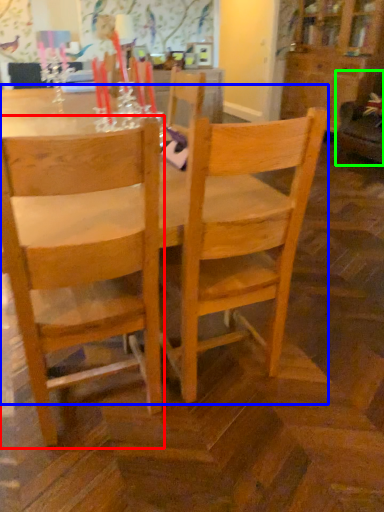
Question: Considering the real-world distances, which object is farthest from chair (highlighted by a red box)? kitchen & dining room table (highlighted by a blue box) or swivel chair (highlighted by a green box)?

Choices:
 (A) kitchen & dining room table
 (B) swivel chair

Answer: (B)